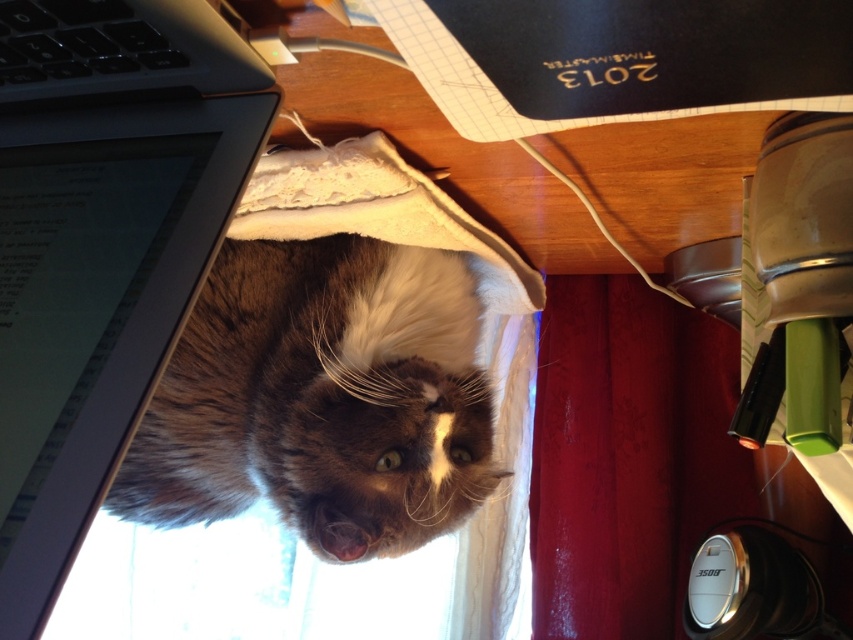
Question: Can you confirm if black plastic laptop at left is positioned above black plastic keyboard at upper left?

Choices:
 (A) yes
 (B) no

Answer: (B)

Question: Is brown fluffy cat at center closer to the viewer compared to red velvet curtain at lower right?

Choices:
 (A) yes
 (B) no

Answer: (A)

Question: Which of the following is the farthest from the observer?

Choices:
 (A) black plastic keyboard at upper left
 (B) black plastic laptop at left
 (C) brown fluffy cat at center
 (D) red velvet curtain at lower right

Answer: (D)

Question: Where is brown fluffy cat at center located in relation to red velvet curtain at lower right in the image?

Choices:
 (A) left
 (B) right

Answer: (A)

Question: Which of the following is the farthest from the observer?

Choices:
 (A) black plastic keyboard at upper left
 (B) brown fluffy cat at center
 (C) black plastic laptop at left
 (D) red velvet curtain at lower right

Answer: (D)

Question: Estimate the real-world distances between objects in this image. Which object is closer to the brown fluffy cat at center?

Choices:
 (A) red velvet curtain at lower right
 (B) black plastic laptop at left

Answer: (B)